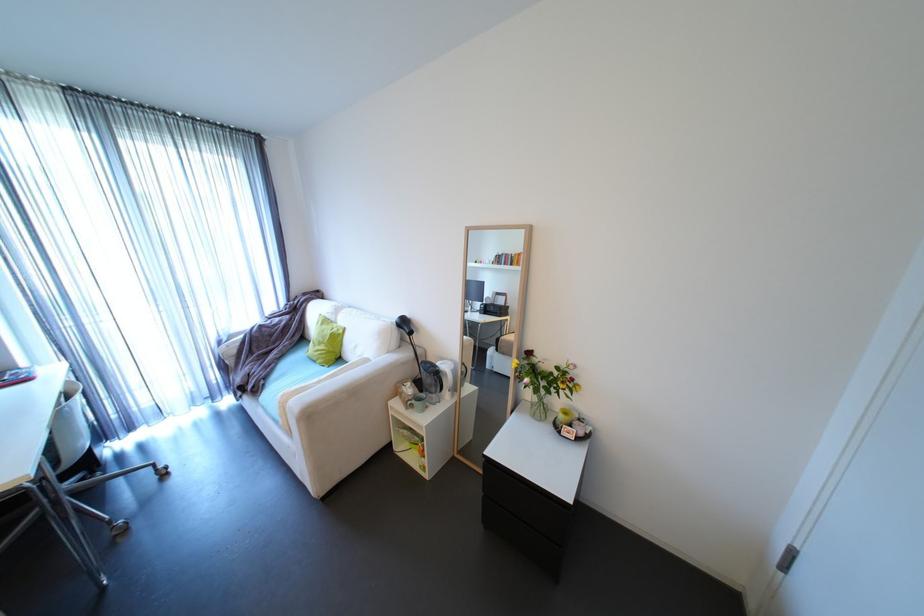
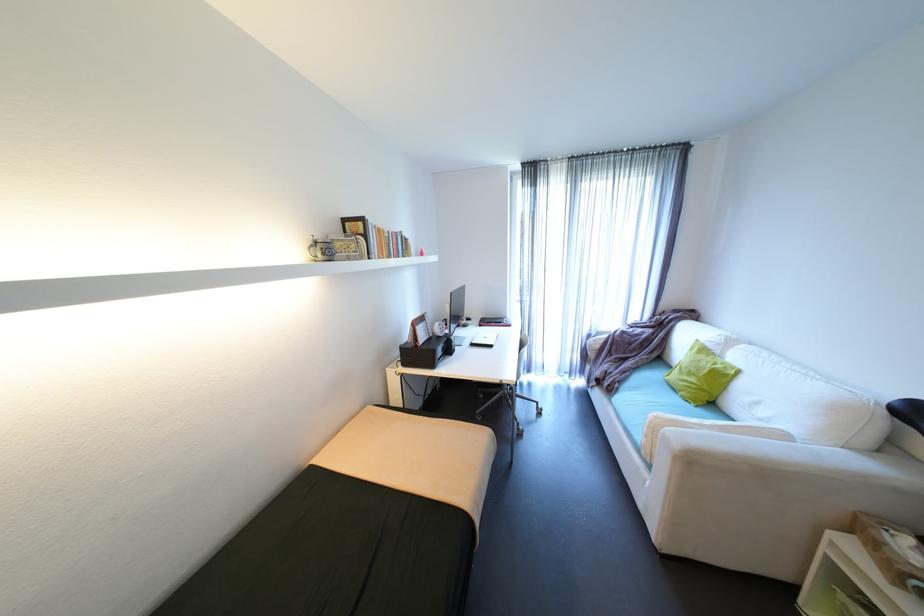
In the second image, find the point that corresponds to point 274,370 in the first image.

(630, 377)